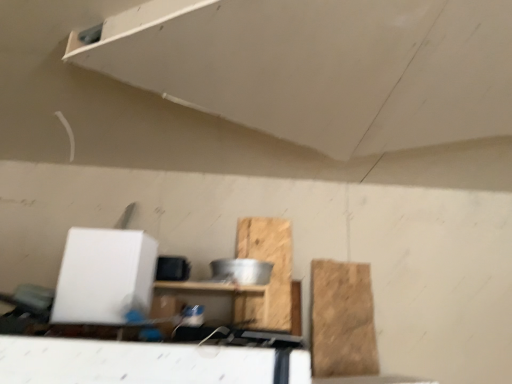
Find the location of `empty space that is ontop of white matte exhaust hood at upper center (from a real-world perspective)`. empty space that is ontop of white matte exhaust hood at upper center (from a real-world perspective) is located at coordinates (339, 79).